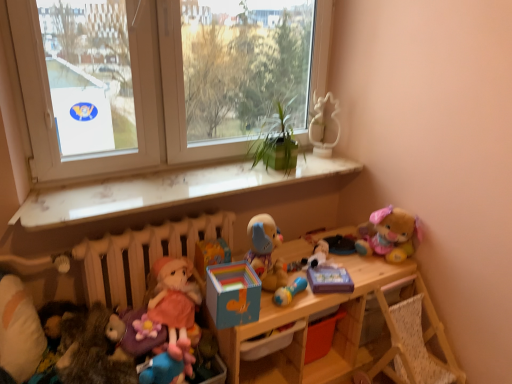
Question: From the image's perspective, is blue rubber rattle at center, the 2th toy when ordered from right to left, located above or below white paper at upper left, which is the 1th window screen in left-to-right order?

Choices:
 (A) below
 (B) above

Answer: (A)

Question: From a real-world perspective, is blue rubber rattle at center, the 2th toy when ordered from right to left, positioned above or below white paper at upper left, which is the 1th window screen in left-to-right order?

Choices:
 (A) below
 (B) above

Answer: (A)

Question: Estimate the real-world distances between objects in this image. Which object is farther from the white glossy statue at upper right?

Choices:
 (A) multicolored cardboard box at center, acting as the 4th toy starting from the right
 (B) white matte radiator at lower left
 (C) fluffy plush bear at upper right, which ranks as the first toy in right-to-left order
 (D) soft plush toy at center, the third toy in the right-to-left sequence
 (E) white paper at upper left, positioned as the 2th window screen in right-to-left order

Answer: (E)

Question: Estimate the real-world distances between objects in this image. Which object is closer to the velvet purple doll at lower left, which is the sixth toy in right-to-left order?

Choices:
 (A) wooden toy box at center
 (B) white soft pillow at lower left
 (C) soft plush toy at center, the third toy in the right-to-left sequence
 (D) white paper at upper left, which is the 1th window screen in left-to-right order
 (E) white glossy statue at upper right

Answer: (B)